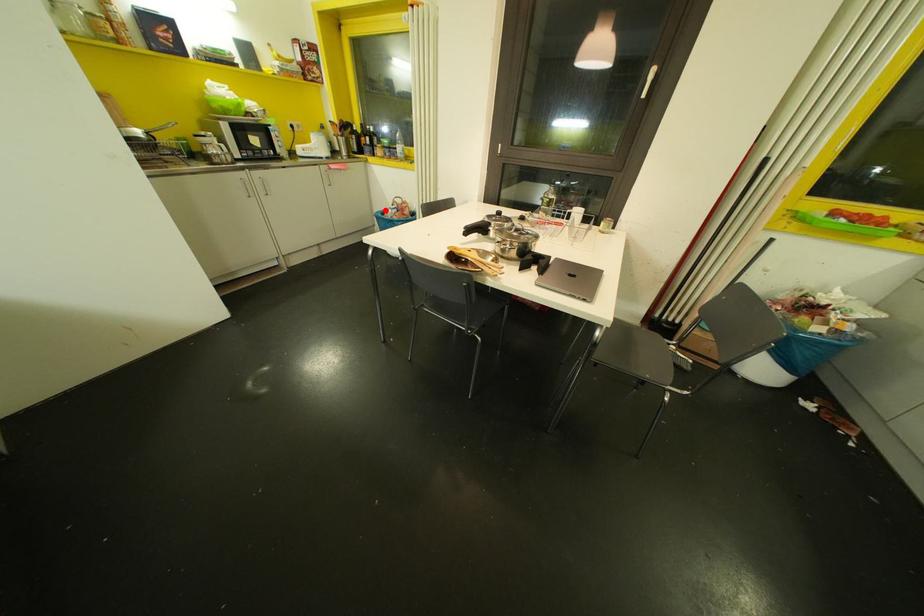
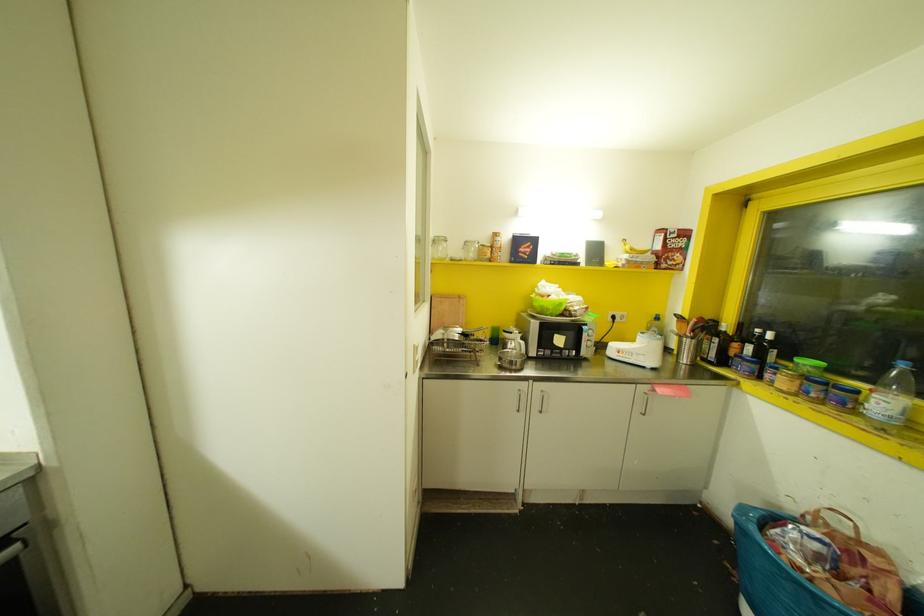
The point at the highlighted location is marked in the first image. Where is the corresponding point in the second image?

(773, 517)